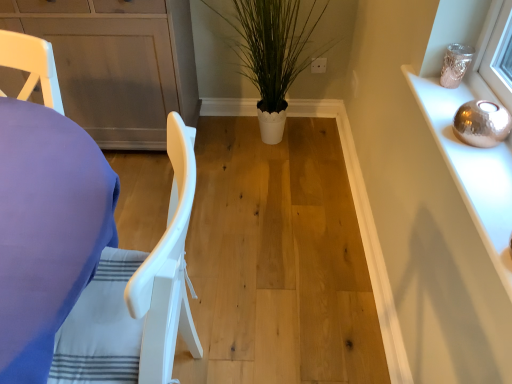
Question: Considering the relative sizes of white plastic chair at left and green leafy plant at center in the image provided, is white plastic chair at left taller than green leafy plant at center?

Choices:
 (A) no
 (B) yes

Answer: (B)

Question: Considering the relative sizes of white plastic chair at left and green leafy plant at center in the image provided, is white plastic chair at left smaller than green leafy plant at center?

Choices:
 (A) yes
 (B) no

Answer: (A)

Question: From a real-world perspective, is white plastic chair at left positioned under green leafy plant at center based on gravity?

Choices:
 (A) no
 (B) yes

Answer: (B)

Question: Can you confirm if white plastic chair at left is wider than green leafy plant at center?

Choices:
 (A) no
 (B) yes

Answer: (B)

Question: Considering the relative sizes of white plastic chair at left and green leafy plant at center in the image provided, is white plastic chair at left thinner than green leafy plant at center?

Choices:
 (A) yes
 (B) no

Answer: (B)

Question: From a real-world perspective, is white plastic chair at left above or below green leafy plant at center?

Choices:
 (A) below
 (B) above

Answer: (A)

Question: Would you say white plastic chair at left is to the left or to the right of green leafy plant at center in the picture?

Choices:
 (A) right
 (B) left

Answer: (B)

Question: In terms of height, does white plastic chair at left look taller or shorter compared to green leafy plant at center?

Choices:
 (A) tall
 (B) short

Answer: (A)

Question: Is point (104, 339) closer or farther from the camera than point (240, 41)?

Choices:
 (A) closer
 (B) farther

Answer: (A)

Question: Relative to white plastic chair at left, is green leafy plant at center in front or behind?

Choices:
 (A) front
 (B) behind

Answer: (B)

Question: Considering the positions of green leafy plant at center and white plastic chair at left in the image, is green leafy plant at center taller or shorter than white plastic chair at left?

Choices:
 (A) tall
 (B) short

Answer: (B)

Question: From the image's perspective, is green leafy plant at center above or below white plastic chair at left?

Choices:
 (A) below
 (B) above

Answer: (B)

Question: Choose the correct answer: Is green leafy plant at center inside white plastic chair at left or outside it?

Choices:
 (A) outside
 (B) inside

Answer: (A)

Question: From the image's perspective, is green leafy plant at center above or below matte gray cabinet at center, marked as the 1th cabinetry in a back-to-front arrangement?

Choices:
 (A) above
 (B) below

Answer: (A)

Question: Choose the correct answer: Is green leafy plant at center inside matte gray cabinet at center, marked as the 1th cabinetry in a back-to-front arrangement, or outside it?

Choices:
 (A) outside
 (B) inside

Answer: (A)